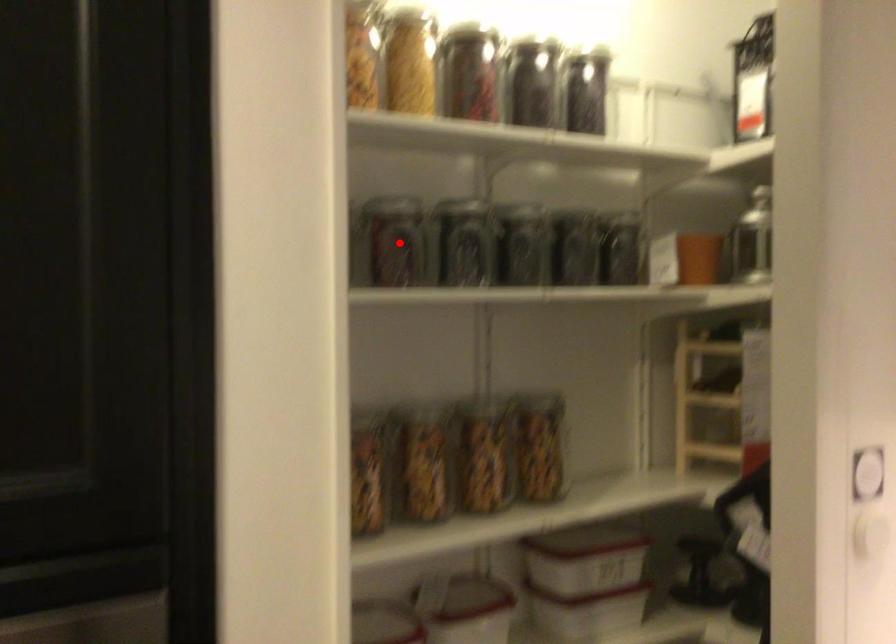
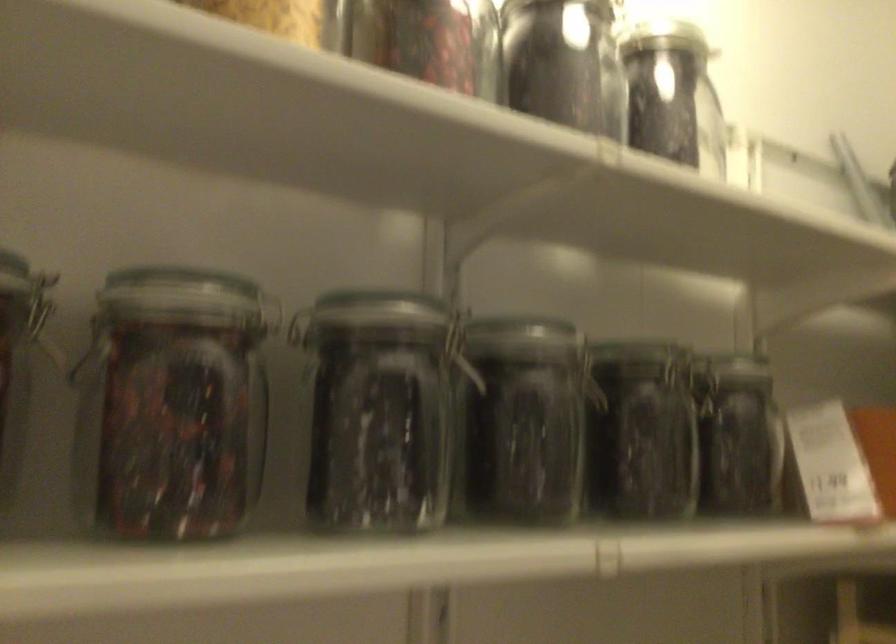
The point at the highlighted location is marked in the first image. Where is the corresponding point in the second image?

(170, 406)